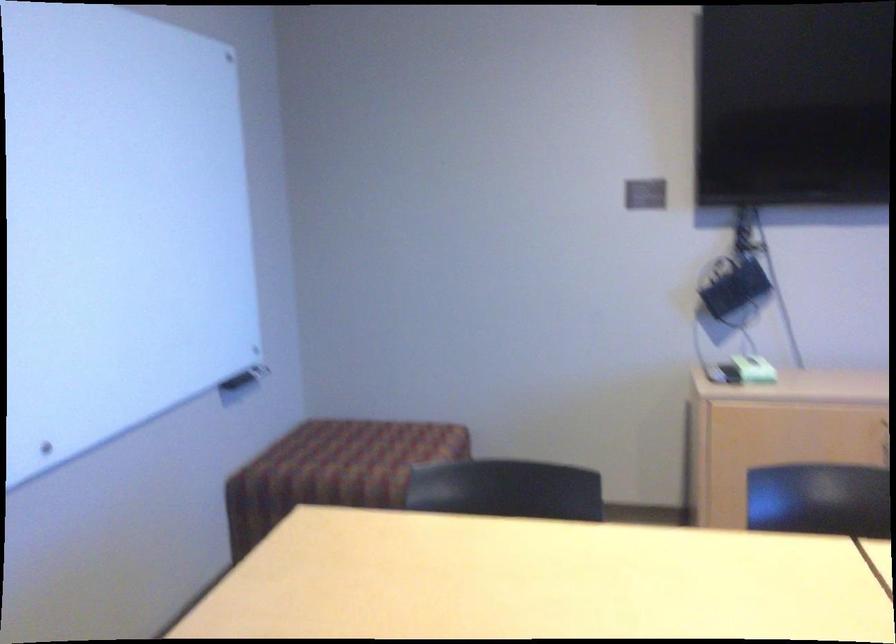
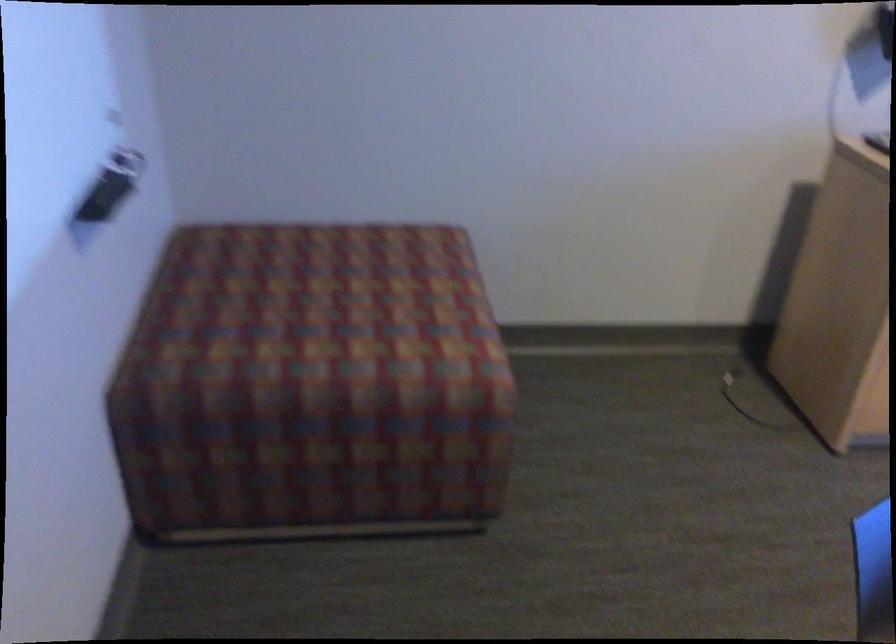
Locate, in the second image, the point that corresponds to the point at 350,450 in the first image.

(332, 301)